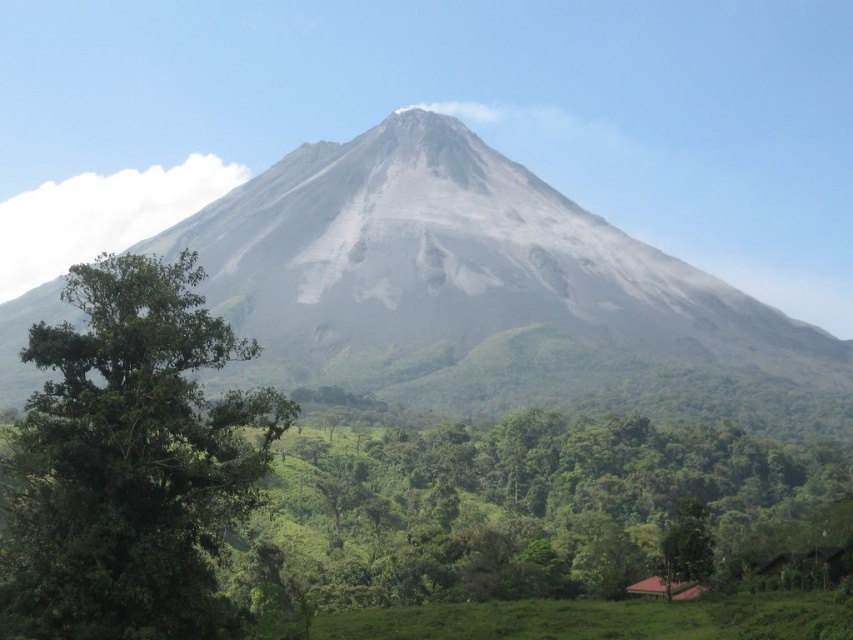
Question: Which is farther from the green leafy tree at lower right?

Choices:
 (A) gray/ashy mountain at center
 (B) green leafy tree at left

Answer: (A)

Question: Observing the image, what is the correct spatial positioning of gray/ashy mountain at center in reference to green leafy tree at lower right?

Choices:
 (A) below
 (B) above

Answer: (B)

Question: Which point is farther from the camera taking this photo?

Choices:
 (A) (175, 385)
 (B) (312, 148)

Answer: (B)

Question: Is green leafy tree at left positioned at the back of green leafy tree at lower right?

Choices:
 (A) no
 (B) yes

Answer: (A)

Question: Can you confirm if gray/ashy mountain at center is smaller than green leafy tree at lower right?

Choices:
 (A) no
 (B) yes

Answer: (A)

Question: Which of the following is the farthest from the observer?

Choices:
 (A) green leafy tree at left
 (B) green leafy tree at lower right
 (C) gray/ashy mountain at center

Answer: (C)